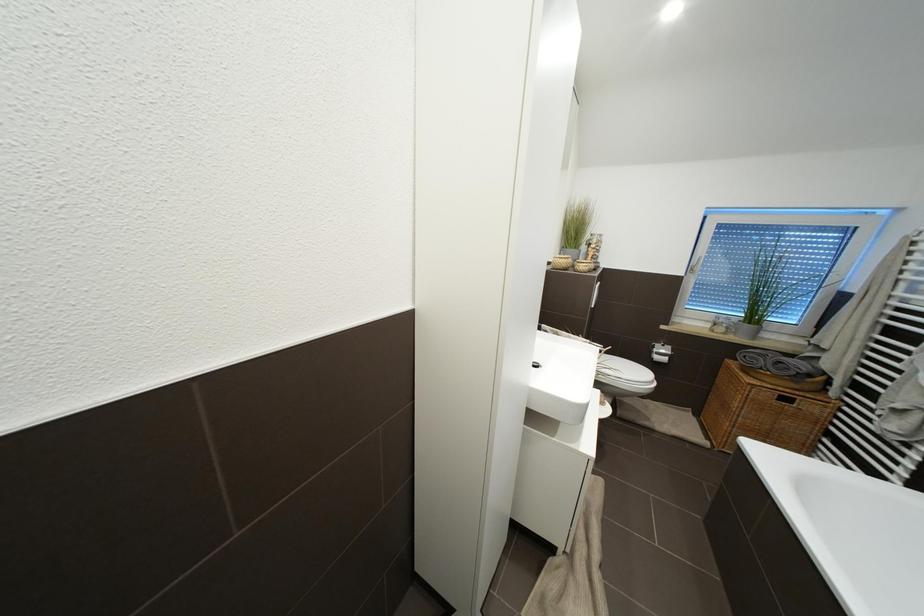
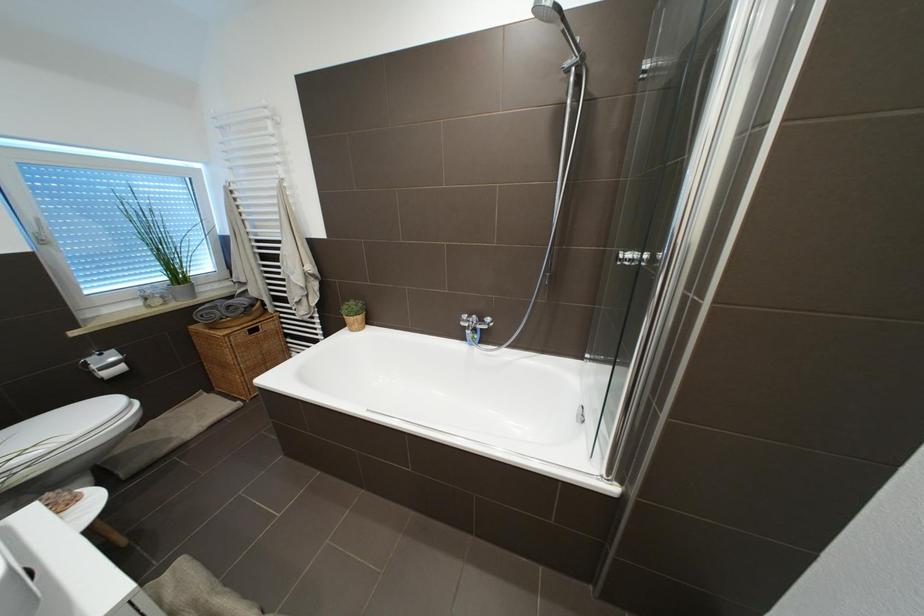
The first image is from the beginning of the video and the second image is from the end. How did the camera likely rotate when shooting the video?

The camera rotated toward right-down.